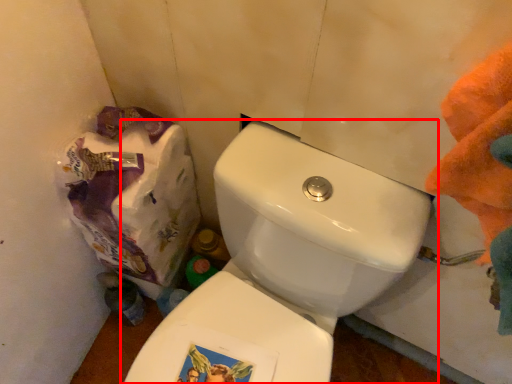
Question: From the image's perspective, what is the correct spatial positioning of toilet (annotated by the red box) in reference to paper bag?

Choices:
 (A) below
 (B) above

Answer: (A)